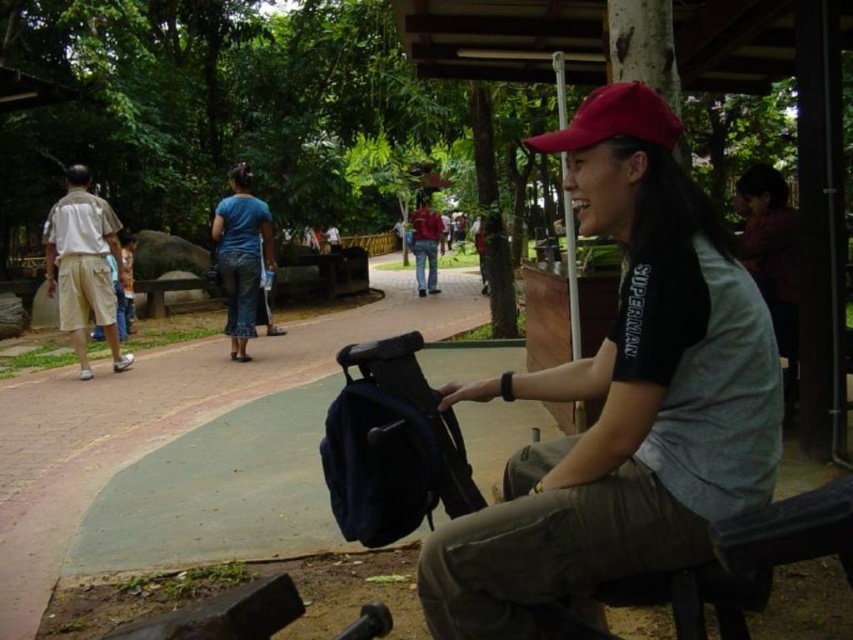
You are a park ranger who needs to determine if the matte black backpack at center can fit inside the light beige cotton shorts at left. Based on their sizes, what would you conclude?

The matte black backpack at center has a smaller size compared to light beige cotton shorts at left, so it cannot fit inside the shorts as the backpack is smaller than the shorts.

You are a park ranger who needs to place a new bench between the matte black backpack at center and the red matte cap at upper center. Which object should the bench be placed closer to to ensure it doesn not block the pathway?

The bench should be placed closer to the red matte cap at upper center because the matte black backpack at center is wider and might block the pathway if the bench is placed near it.